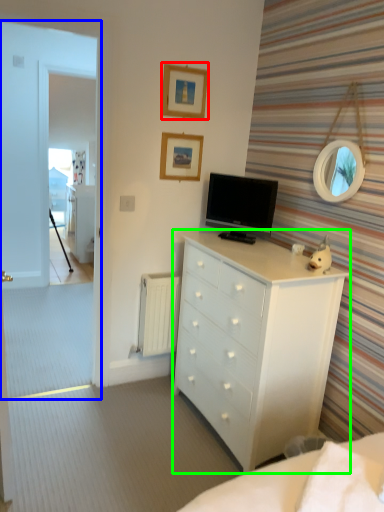
Question: Estimate the real-world distances between objects in this image. Which object is closer to picture frame (highlighted by a red box), glass door (highlighted by a blue box) or chest of drawers (highlighted by a green box)?

Choices:
 (A) glass door
 (B) chest of drawers

Answer: (B)